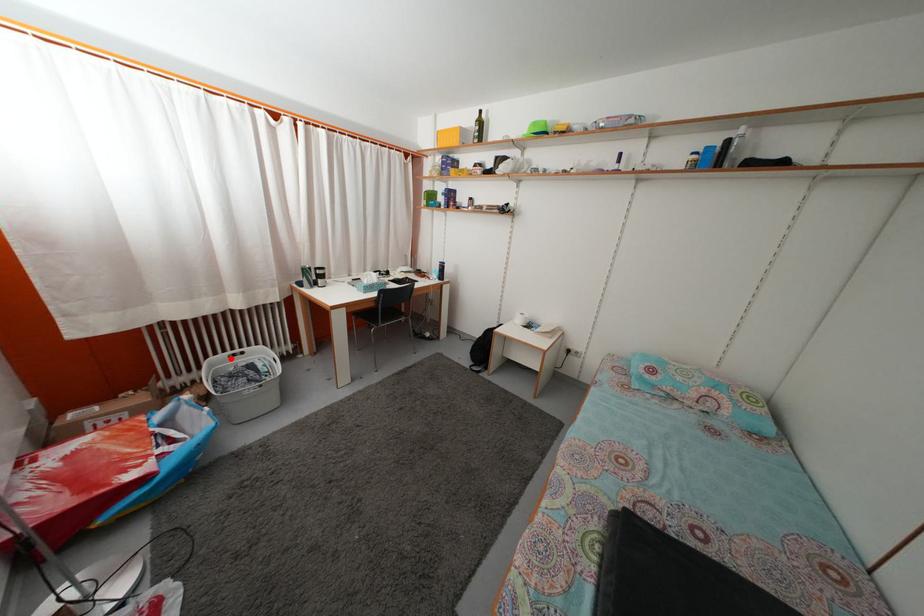
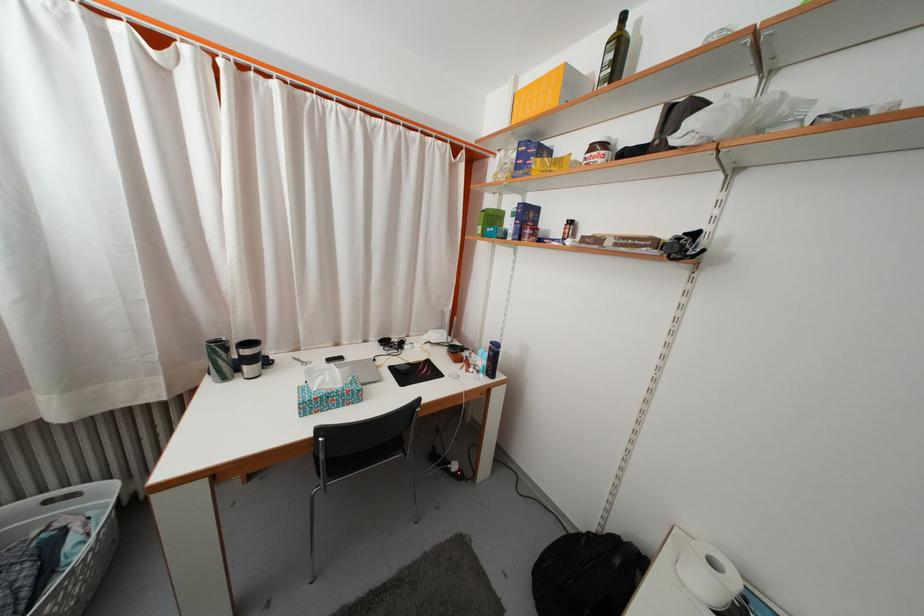
Locate, in the second image, the point that corresponds to the highlighted location in the first image.

(49, 498)